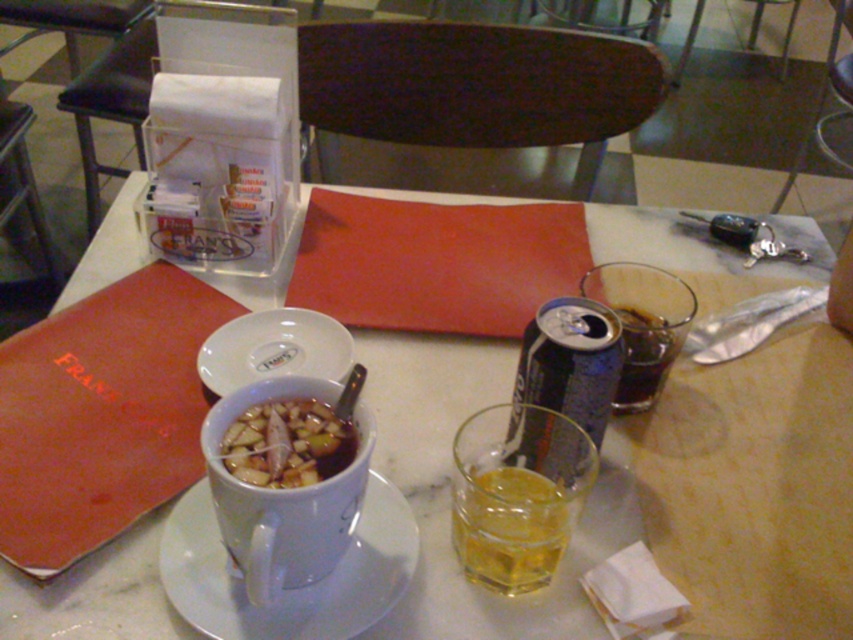
Question: Which point appears farthest from the camera in this image?

Choices:
 (A) (445, 413)
 (B) (566, 433)
 (C) (202, 529)

Answer: (A)

Question: Is white ceramic saucer at center below metallic silver can at center?

Choices:
 (A) no
 (B) yes

Answer: (B)

Question: Does metallic silver can at center have a greater width compared to white ceramic bowl at center?

Choices:
 (A) no
 (B) yes

Answer: (A)

Question: Does white glossy table at center appear under dark brown carbonated can at upper right?

Choices:
 (A) yes
 (B) no

Answer: (A)

Question: Which object is the closest to the white plastic napkin dispenser at center?

Choices:
 (A) white ceramic bowl at center
 (B) white glossy table at center

Answer: (B)

Question: Which object is farther from the camera taking this photo?

Choices:
 (A) translucent glass at center
 (B) white ceramic saucer at center
 (C) white plastic napkin dispenser at center
 (D) white glossy table at center

Answer: (C)